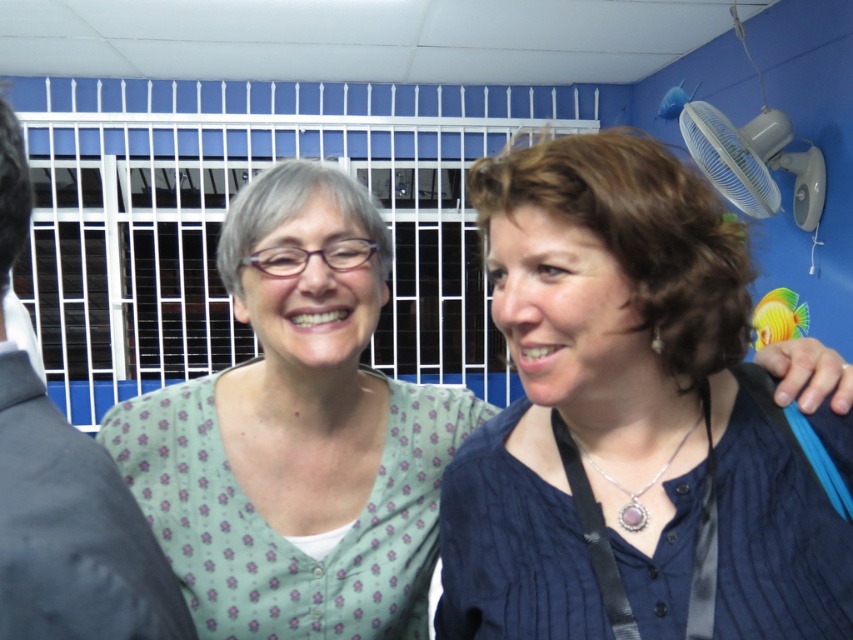
You are a photographer adjusting your camera settings. You notice the blue textured blouse at center and the black matte hair at left in your frame. Which object appears wider in the photo?

The blue textured blouse at center appears wider than the black matte hair at left because its width surpasses the latter.

You are taking a photo of two people standing in front of you. You notice two points marked in the image. The first point is at coordinate point (149, 552) and the second is at point (619, 145). Which point is nearer to your camera lens?

Point (149, 552) is closer to the camera lens than point (619, 145).